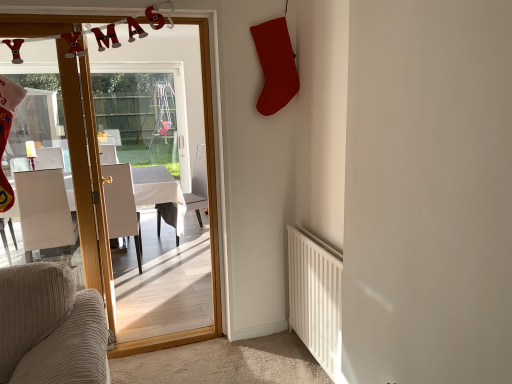
Measure the distance between white leather chair at left, the 1th chair when ordered from left to right, and camera.

The depth of white leather chair at left, the 1th chair when ordered from left to right, is 3.36 meters.

This screenshot has width=512, height=384. What do you see at coordinates (44, 211) in the screenshot?
I see `white leather chair at left, which ranks as the 3th chair in right-to-left order` at bounding box center [44, 211].

This screenshot has height=384, width=512. I want to click on white leather chair at center, the 3th chair viewed from the left, so click(198, 185).

Find the location of a particular element. wooden glass door at center is located at coordinates (209, 219).

From the image's perspective, between white matte radiator at lower right and white glossy table at center, who is located below?

From the image's view, white matte radiator at lower right is below.

From their relative heights in the image, would you say white matte radiator at lower right is taller or shorter than white glossy table at center?

white matte radiator at lower right is taller than white glossy table at center.

Is white matte radiator at lower right far from white glossy table at center?

Absolutely, white matte radiator at lower right is distant from white glossy table at center.

From a real-world perspective, between white matte radiator at lower right and white glossy table at center, who is vertically higher?

white matte radiator at lower right, from a real-world perspective.

From a real-world perspective, starting from the wooden glass door at center, which chair is the 2nd one below it? Please provide its 2D coordinates.

[(121, 205)]

Looking at this image, is wooden glass door at center to the left or to the right of white leather chair at left, acting as the second chair starting from the left, in the image?

From the image, it's evident that wooden glass door at center is to the right of white leather chair at left, acting as the second chair starting from the left.

Which of these two, wooden glass door at center or white leather chair at left, acting as the second chair starting from the left, is smaller?

white leather chair at left, acting as the second chair starting from the left.

Are wooden glass door at center and white leather chair at left, which appears as the 2th chair when viewed from the right, making contact?

No, wooden glass door at center is not with white leather chair at left, which appears as the 2th chair when viewed from the right.

Is white leather chair at left, which ranks as the 3th chair in right-to-left order, at the back of white glossy table at center?

No.

Is point (170, 183) farther from viewer compared to point (36, 245)?

Yes.

How much distance is there between white glossy table at center and white leather chair at left, which ranks as the 3th chair in right-to-left order?

white glossy table at center is 57.56 centimeters away from white leather chair at left, which ranks as the 3th chair in right-to-left order.

Is white glossy table at center in contact with white leather chair at left, the 1th chair when ordered from left to right?

white glossy table at center and white leather chair at left, the 1th chair when ordered from left to right, are clearly separated.

Looking at this image, which point is more forward, (144, 201) or (205, 162)?

The point (144, 201) is in front.

Is white glossy table at center facing away from white leather chair at center, which is the first chair from right to left?

No, white glossy table at center's orientation is not away from white leather chair at center, which is the first chair from right to left.

Is white glossy table at center touching white leather chair at center, which is the first chair from right to left?

No, white glossy table at center is not beside white leather chair at center, which is the first chair from right to left.

From a real-world perspective, is white matte radiator at lower right located higher than white leather chair at left, the 1th chair when ordered from left to right?

No.

Between white matte radiator at lower right and white leather chair at left, which ranks as the 3th chair in right-to-left order, which one has larger size?

white leather chair at left, which ranks as the 3th chair in right-to-left order, is bigger.

Is white matte radiator at lower right wider or thinner than white leather chair at left, the 1th chair when ordered from left to right?

white matte radiator at lower right is thinner than white leather chair at left, the 1th chair when ordered from left to right.

From a real-world perspective, who is located higher, white matte radiator at lower right or white leather chair at center, the 3th chair viewed from the left?

white leather chair at center, the 3th chair viewed from the left, from a real-world perspective.

Between white matte radiator at lower right and white leather chair at center, the 3th chair viewed from the left, which one has more height?

white leather chair at center, the 3th chair viewed from the left.

Is white matte radiator at lower right placed right next to white leather chair at center, the 3th chair viewed from the left?

No, white matte radiator at lower right is not next to white leather chair at center, the 3th chair viewed from the left.

Considering their positions, is white matte radiator at lower right located in front of or behind white leather chair at center, the 3th chair viewed from the left?

white matte radiator at lower right is in front of white leather chair at center, the 3th chair viewed from the left.

From the image's perspective, is wooden glass door at center located above or below white glossy table at center?

From the image's perspective, wooden glass door at center appears above white glossy table at center.

From a real-world perspective, is wooden glass door at center positioned under white glossy table at center based on gravity?

Actually, wooden glass door at center is physically above white glossy table at center in the real world.

Considering the relative positions of wooden glass door at center and white glossy table at center in the image provided, is wooden glass door at center to the left of white glossy table at center from the viewer's perspective?

No, wooden glass door at center is not to the left of white glossy table at center.

Is white glossy table at center surrounded by wooden glass door at center?

Actually, white glossy table at center is outside wooden glass door at center.

I want to click on radiator in front of the white glossy table at center, so click(315, 298).

Image resolution: width=512 pixels, height=384 pixels. Identify the location of door that is above the white leather chair at left, which appears as the 2th chair when viewed from the right (from the image's perspective). coord(209,219).

Estimate the real-world distances between objects in this image. Which object is closer to white leather chair at center, which is the first chair from right to left, wooden glass door at center or white leather chair at left, acting as the second chair starting from the left?

white leather chair at left, acting as the second chair starting from the left.

Based on their spatial positions, is white leather chair at left, which appears as the 2th chair when viewed from the right, or wooden glass door at center closer to white matte radiator at lower right?

wooden glass door at center is positioned closer to the anchor white matte radiator at lower right.

Based on their spatial positions, is white matte radiator at lower right or white glossy table at center further from white leather chair at left, which appears as the 2th chair when viewed from the right?

white matte radiator at lower right is further to white leather chair at left, which appears as the 2th chair when viewed from the right.

From the image, which object appears to be nearer to white leather chair at center, the 3th chair viewed from the left, white matte radiator at lower right or white leather chair at left, which appears as the 2th chair when viewed from the right?

The object closer to white leather chair at center, the 3th chair viewed from the left, is white leather chair at left, which appears as the 2th chair when viewed from the right.

When comparing their distances from white leather chair at left, acting as the second chair starting from the left, does white leather chair at left, the 1th chair when ordered from left to right, or wooden glass door at center seem closer?

white leather chair at left, the 1th chair when ordered from left to right.

Which object lies further to the anchor point white leather chair at center, which is the first chair from right to left, white glossy table at center or white leather chair at left, acting as the second chair starting from the left?

white leather chair at left, acting as the second chair starting from the left, lies further to white leather chair at center, which is the first chair from right to left, than the other object.

Considering their positions, is white leather chair at center, the 3th chair viewed from the left, positioned further to white glossy table at center than wooden glass door at center?

wooden glass door at center is further to white glossy table at center.

When comparing their distances from white leather chair at center, the 3th chair viewed from the left, does white matte radiator at lower right or white leather chair at left, the 1th chair when ordered from left to right, seem further?

white matte radiator at lower right lies further to white leather chair at center, the 3th chair viewed from the left, than the other object.

You are a GUI agent. You are given a task and a screenshot of the screen. Output one action in this format:
    pyautogui.click(x=<x>, y=<y>)
    Task: Click on the table between white leather chair at left, which ranks as the 3th chair in right-to-left order, and white matte radiator at lower right from left to right
    Image resolution: width=512 pixels, height=384 pixels.
    Given the screenshot: What is the action you would take?
    pyautogui.click(x=140, y=198)

Where is `table situated between white leather chair at left, the 1th chair when ordered from left to right, and white leather chair at center, which is the first chair from right to left, from left to right`? The image size is (512, 384). table situated between white leather chair at left, the 1th chair when ordered from left to right, and white leather chair at center, which is the first chair from right to left, from left to right is located at coordinates (140, 198).

Find the location of `table situated between white leather chair at left, which ranks as the 3th chair in right-to-left order, and white leather chair at left, which appears as the 2th chair when viewed from the right, from left to right`. table situated between white leather chair at left, which ranks as the 3th chair in right-to-left order, and white leather chair at left, which appears as the 2th chair when viewed from the right, from left to right is located at coordinates (140, 198).

Where is `table positioned between wooden glass door at center and white leather chair at left, which appears as the 2th chair when viewed from the right, from near to far`? table positioned between wooden glass door at center and white leather chair at left, which appears as the 2th chair when viewed from the right, from near to far is located at coordinates (140, 198).